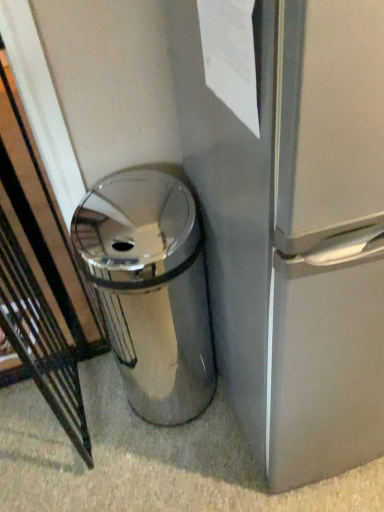
Identify the location of white paper at upper center. [230, 56].

The width and height of the screenshot is (384, 512). What do you see at coordinates (230, 56) in the screenshot?
I see `white paper at upper center` at bounding box center [230, 56].

Measure the distance between white paper at upper center and camera.

The distance of white paper at upper center from camera is 18.15 inches.

In order to face white paper at upper center, should I rotate leftwards or rightwards?

To align with it, rotate right about 4.072°.

What is the approximate height of white paper at upper center?

It is 12.00 inches.

What is the approximate width of polished silver trash can at center?

polished silver trash can at center is 12.76 inches in width.

Where is `polished silver trash can at center`? The image size is (384, 512). polished silver trash can at center is located at coordinates (150, 290).

Image resolution: width=384 pixels, height=512 pixels. What do you see at coordinates (150, 290) in the screenshot? I see `polished silver trash can at center` at bounding box center [150, 290].

You are a GUI agent. You are given a task and a screenshot of the screen. Output one action in this format:
    pyautogui.click(x=<x>, y=<y>)
    Task: Click on the white paper at upper center
    This screenshot has width=384, height=512.
    Given the screenshot: What is the action you would take?
    pyautogui.click(x=230, y=56)

Which is more to the left, white paper at upper center or polished silver trash can at center?

From the viewer's perspective, polished silver trash can at center appears more on the left side.

Which object is further away from the camera taking this photo, white paper at upper center or polished silver trash can at center?

polished silver trash can at center is further from the camera.

Considering the positions of point (208, 63) and point (168, 346), is point (208, 63) closer or farther from the camera than point (168, 346)?

Clearly, point (208, 63) is closer to the camera than point (168, 346).

From the image's perspective, is white paper at upper center on polished silver trash can at center?

Correct, white paper at upper center appears higher than polished silver trash can at center in the image.

From a real-world perspective, is white paper at upper center above or below polished silver trash can at center?

Clearly, from a real-world perspective, white paper at upper center is above polished silver trash can at center.

Which of these two, white paper at upper center or polished silver trash can at center, is wider?

polished silver trash can at center is wider.

Between white paper at upper center and polished silver trash can at center, which one has less height?

white paper at upper center.

Looking at this image, based on their sizes in the image, would you say white paper at upper center is bigger or smaller than polished silver trash can at center?

white paper at upper center is smaller than polished silver trash can at center.

Based on the photo, do you think white paper at upper center is within polished silver trash can at center, or outside of it?

white paper at upper center is not enclosed by polished silver trash can at center.

Is white paper at upper center positioned far away from polished silver trash can at center?

No, white paper at upper center is not far away from polished silver trash can at center.

Is white paper at upper center facing towards polished silver trash can at center?

No, white paper at upper center is not facing towards polished silver trash can at center.

This screenshot has height=512, width=384. What are the coordinates of `waste container below the white paper at upper center (from the image's perspective)` in the screenshot? It's located at (150, 290).

Visually, is polished silver trash can at center positioned to the left or to the right of white paper at upper center?

polished silver trash can at center is positioned on white paper at upper center's left side.

Does polished silver trash can at center come in front of white paper at upper center?

No, polished silver trash can at center is behind white paper at upper center.

Which is closer to the camera, (160,317) or (217,14)?

Point (160,317) appears to be farther away from the viewer than point (217,14).

From the image's perspective, which one is positioned higher, polished silver trash can at center or white paper at upper center?

From the image's view, white paper at upper center is above.

From a real-world perspective, is polished silver trash can at center located beneath white paper at upper center?

Yes, from a real-world perspective, polished silver trash can at center is under white paper at upper center.

Considering the sizes of objects polished silver trash can at center and white paper at upper center in the image provided, who is thinner, polished silver trash can at center or white paper at upper center?

Thinner between the two is white paper at upper center.

Considering the sizes of objects polished silver trash can at center and white paper at upper center in the image provided, who is shorter, polished silver trash can at center or white paper at upper center?

Standing shorter between the two is white paper at upper center.

Does polished silver trash can at center have a larger size compared to white paper at upper center?

Indeed, polished silver trash can at center has a larger size compared to white paper at upper center.

Is polished silver trash can at center positioned beyond the bounds of white paper at upper center?

Yes, polished silver trash can at center is not within white paper at upper center.

Is polished silver trash can at center not near white paper at upper center?

No.

Is polished silver trash can at center facing away from white paper at upper center?

No.

How many degrees apart are the facing directions of polished silver trash can at center and white paper at upper center?

The angle between the facing direction of polished silver trash can at center and the facing direction of white paper at upper center is 90 degrees.

Find the location of a particular element. paper in front of the polished silver trash can at center is located at coordinates (230, 56).

Locate an element on the screen. This screenshot has width=384, height=512. paper on the right side of polished silver trash can at center is located at coordinates (230, 56).

Find the location of a particular element. This screenshot has height=512, width=384. waste container on the left of white paper at upper center is located at coordinates (150, 290).